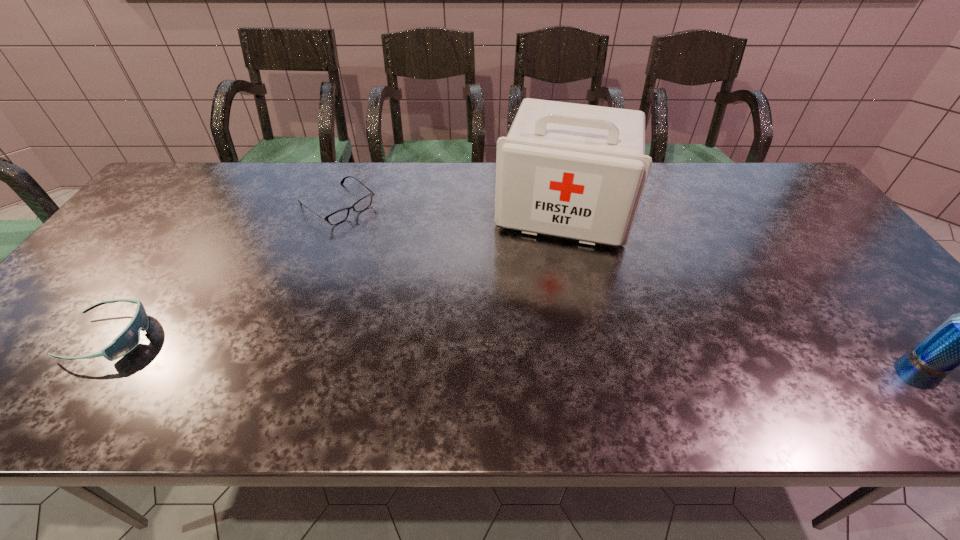
At what (x,y) coordinates should I click in order to perform the action: click on the third tallest object. Please return your answer as a coordinate pair (x, y). Looking at the image, I should click on (128, 339).

Image resolution: width=960 pixels, height=540 pixels. Find the location of `the leftmost object`. the leftmost object is located at coordinates click(128, 339).

Locate an element on the screen. the shortest object is located at coordinates (339, 216).

The height and width of the screenshot is (540, 960). Identify the location of spectacles. (339, 216).

What are the coordinates of `the first-aid kit` in the screenshot? It's located at (577, 171).

Find the location of `the second object from right to left`. the second object from right to left is located at coordinates (577, 171).

Identify the location of free region located 0.280m on the front-facing side of the goggles. The image size is (960, 540). (273, 338).

You are a GUI agent. You are given a task and a screenshot of the screen. Output one action in this format:
    pyautogui.click(x=<x>, y=<y>)
    Task: Click on the vacant space positioned on the front-facing side of the shortest object
    The image size is (960, 540).
    Given the screenshot: What is the action you would take?
    pyautogui.click(x=396, y=248)

At what (x,y) coordinates should I click in order to perform the action: click on vacant area located 0.350m on the front-facing side of the shortest object. Please return your answer as a coordinate pair (x, y). This screenshot has width=960, height=540. Looking at the image, I should click on (443, 284).

The image size is (960, 540). In order to click on free space located on the front-facing side of the shortest object in this screenshot , I will do 410,259.